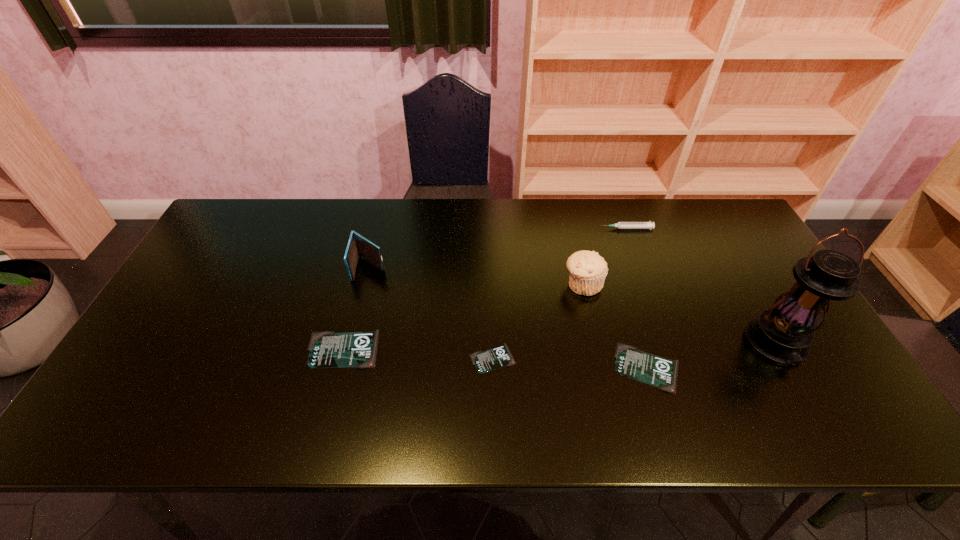
Locate an element on the screen. The width and height of the screenshot is (960, 540). identity card that is the third closest one to the wallet is located at coordinates (644, 367).

Locate an element on the screen. The width and height of the screenshot is (960, 540). identity card identified as the second closest to the syringe is located at coordinates (485, 361).